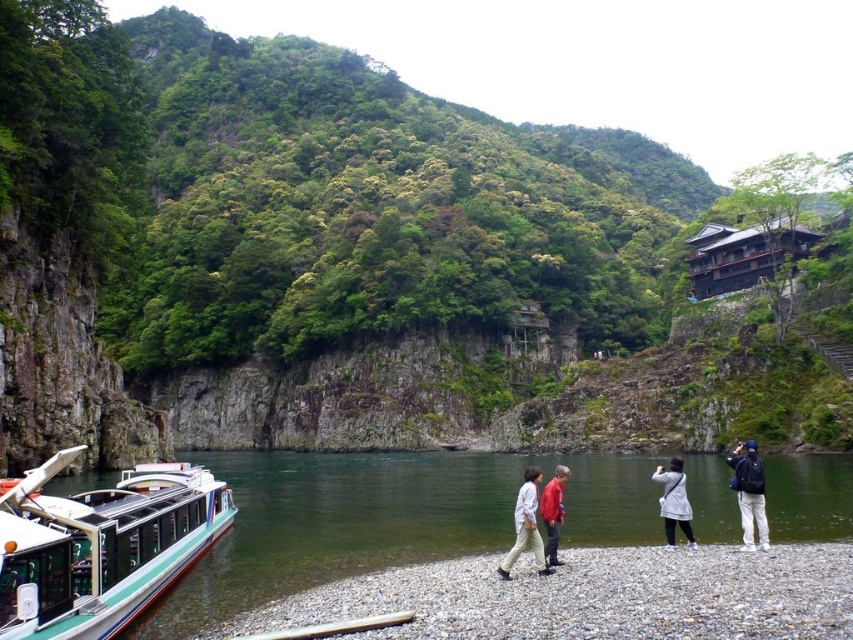
Question: Which object is the closest to the dark blue backpack at lower right?

Choices:
 (A) light beige pants at center
 (B) green and white plastic boat at lower left
 (C) light gray fabric coat at lower center
 (D) gray gravel shoreline at lower center

Answer: (C)

Question: Is green smooth water at lower center below green and white plastic boat at lower left?

Choices:
 (A) yes
 (B) no

Answer: (A)

Question: Is light beige pants at center to the left of red matte jacket at center from the viewer's perspective?

Choices:
 (A) no
 (B) yes

Answer: (B)

Question: Is gray gravel shoreline at lower center bigger than red matte jacket at center?

Choices:
 (A) yes
 (B) no

Answer: (B)

Question: Which point is farther to the camera?

Choices:
 (A) green leafy hillside at upper center
 (B) green smooth water at lower center

Answer: (A)

Question: Which object appears farthest from the camera in this image?

Choices:
 (A) light beige pants at center
 (B) red matte jacket at center
 (C) green leafy hillside at upper center

Answer: (C)